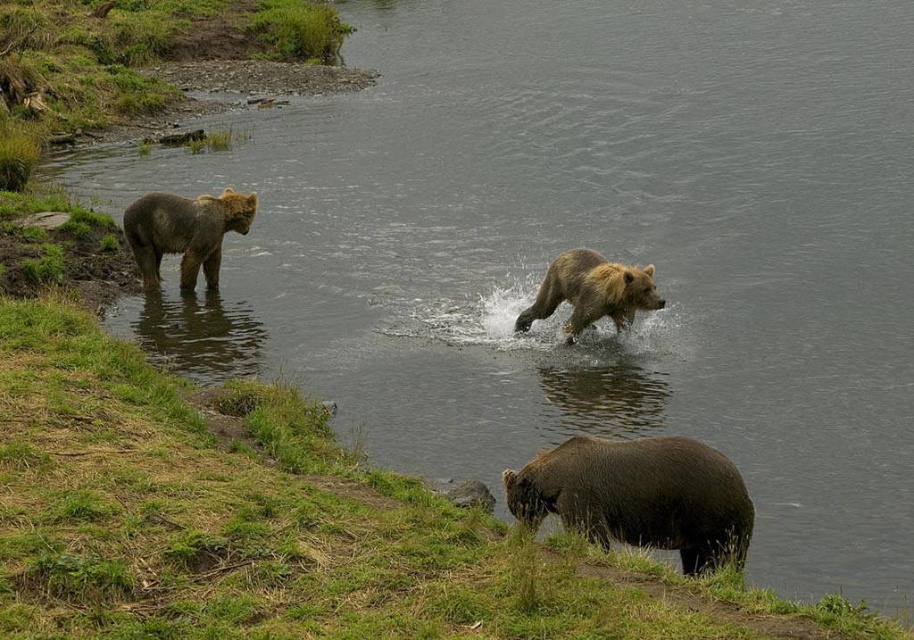
Question: Does brown furry bear at left appear over brown fur bear at center?

Choices:
 (A) no
 (B) yes

Answer: (B)

Question: Which object appears closest to the camera in this image?

Choices:
 (A) brown furry bear at left
 (B) brown fur bear at center
 (C) brown fur bear at lower right

Answer: (C)

Question: Among these objects, which one is farthest from the camera?

Choices:
 (A) brown fur bear at center
 (B) brown furry bear at left

Answer: (B)

Question: Does brown fur bear at lower right have a larger size compared to brown fur bear at center?

Choices:
 (A) yes
 (B) no

Answer: (B)

Question: Estimate the real-world distances between objects in this image. Which object is closer to the brown fur bear at center?

Choices:
 (A) brown furry bear at left
 (B) brown fur bear at lower right

Answer: (A)

Question: Does brown fur bear at lower right appear on the left side of brown fur bear at center?

Choices:
 (A) no
 (B) yes

Answer: (B)